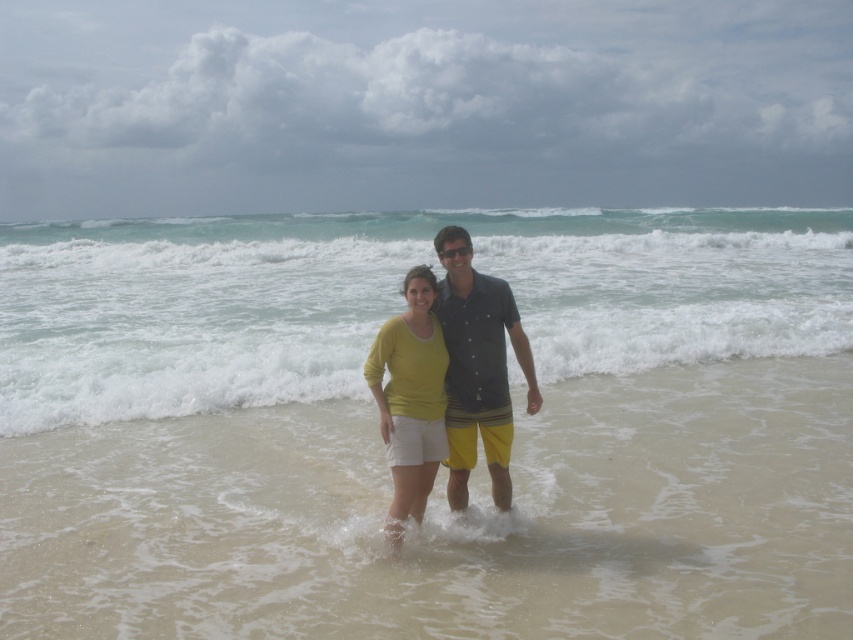
Can you confirm if clear blue water at center is taller than matte yellow sweater at center?

Correct, clear blue water at center is much taller as matte yellow sweater at center.

Between point (561, 252) and point (408, 355), which one is positioned behind?

The point (561, 252) is behind.

This screenshot has width=853, height=640. I want to click on clear blue water at center, so click(390, 300).

Does point (711, 472) come behind point (756, 333)?

No, (711, 472) is in front of (756, 333).

Which is behind, point (527, 560) or point (38, 385)?

Positioned behind is point (38, 385).

The height and width of the screenshot is (640, 853). I want to click on smooth sand at center, so click(450, 518).

Can you confirm if smooth sand at center is positioned below dark blue button-up shirt at center?

Indeed, smooth sand at center is positioned under dark blue button-up shirt at center.

Can you confirm if smooth sand at center is positioned above dark blue button-up shirt at center?

No, smooth sand at center is not above dark blue button-up shirt at center.

Who is more forward, (x=512, y=627) or (x=529, y=404)?

Point (x=512, y=627) is in front.

You are a GUI agent. You are given a task and a screenshot of the screen. Output one action in this format:
    pyautogui.click(x=<x>, y=<y>)
    Task: Click on the smooth sand at center
    
    Given the screenshot: What is the action you would take?
    pyautogui.click(x=450, y=518)